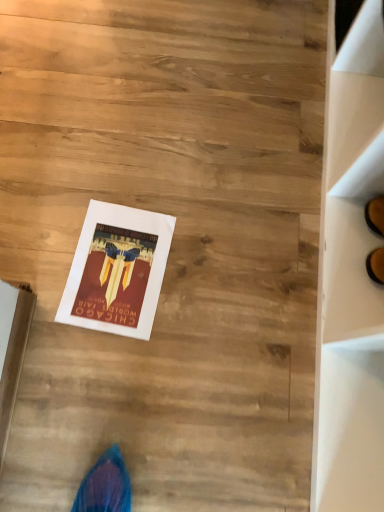
Find the location of `matte paper poster at center`. matte paper poster at center is located at coordinates (x=117, y=270).

Describe the element at coordinates (117, 270) in the screenshot. I see `matte paper poster at center` at that location.

Describe the element at coordinates (12, 349) in the screenshot. I see `white cardboard box at lower left` at that location.

The height and width of the screenshot is (512, 384). I want to click on white cardboard box at lower left, so click(12, 349).

You are a GUI agent. You are given a task and a screenshot of the screen. Output one action in this format:
    pyautogui.click(x=<x>, y=<y>)
    Task: Click on the matte paper poster at center
    
    Given the screenshot: What is the action you would take?
    pyautogui.click(x=117, y=270)

Between white cardboard box at lower left and matte paper poster at center, which one appears on the left side from the viewer's perspective?

white cardboard box at lower left is more to the left.

Does white cardboard box at lower left lie in front of matte paper poster at center?

Yes, the depth of white cardboard box at lower left is less than that of matte paper poster at center.

Is point (5, 361) farther from camera compared to point (106, 317)?

No.

From the picture: From the image's perspective, does white cardboard box at lower left appear lower than matte paper poster at center?

Correct, white cardboard box at lower left appears lower than matte paper poster at center in the image.

From a real-world perspective, is white cardboard box at lower left positioned above or below matte paper poster at center?

white cardboard box at lower left is above matte paper poster at center.

Considering the sizes of objects white cardboard box at lower left and matte paper poster at center in the image provided, who is thinner, white cardboard box at lower left or matte paper poster at center?

With smaller width is white cardboard box at lower left.

From their relative heights in the image, would you say white cardboard box at lower left is taller or shorter than matte paper poster at center?

white cardboard box at lower left is taller than matte paper poster at center.

Considering the relative sizes of white cardboard box at lower left and matte paper poster at center in the image provided, is white cardboard box at lower left smaller than matte paper poster at center?

Yes, white cardboard box at lower left is smaller than matte paper poster at center.

Is white cardboard box at lower left located outside matte paper poster at center?

Yes, white cardboard box at lower left is outside of matte paper poster at center.

Is white cardboard box at lower left in contact with matte paper poster at center?

They are not placed beside each other.

Is white cardboard box at lower left facing away from matte paper poster at center?

No, white cardboard box at lower left is not facing away from matte paper poster at center.

Measure the distance from white cardboard box at lower left to matte paper poster at center.

white cardboard box at lower left is 7.30 inches from matte paper poster at center.

Identify the location of cardboard box above the matte paper poster at center (from a real-world perspective). (12, 349).

Which object is positioned more to the left, matte paper poster at center or white cardboard box at lower left?

From the viewer's perspective, white cardboard box at lower left appears more on the left side.

Considering their positions, is matte paper poster at center located in front of or behind white cardboard box at lower left?

matte paper poster at center is positioned farther from the viewer than white cardboard box at lower left.

Between point (121, 212) and point (23, 330), which one is positioned behind?

The point (121, 212) is farther from the camera.

From the image's perspective, is matte paper poster at center located beneath white cardboard box at lower left?

No, from the image's perspective, matte paper poster at center is not beneath white cardboard box at lower left.

From a real-world perspective, is matte paper poster at center physically above white cardboard box at lower left?

No, from a real-world perspective, matte paper poster at center is not above white cardboard box at lower left.

Which object is thinner, matte paper poster at center or white cardboard box at lower left?

white cardboard box at lower left.

Between matte paper poster at center and white cardboard box at lower left, which one has less height?

matte paper poster at center is shorter.

Looking at the image, does matte paper poster at center seem bigger or smaller compared to white cardboard box at lower left?

In the image, matte paper poster at center appears to be larger than white cardboard box at lower left.

Is white cardboard box at lower left a part of matte paper poster at center?

No, white cardboard box at lower left is not surrounded by matte paper poster at center.

Can you see matte paper poster at center touching white cardboard box at lower left?

No, matte paper poster at center is not beside white cardboard box at lower left.

Is matte paper poster at center oriented towards white cardboard box at lower left?

No, matte paper poster at center does not turn towards white cardboard box at lower left.

From the picture: How many degrees apart are the facing directions of matte paper poster at center and white cardboard box at lower left?

matte paper poster at center and white cardboard box at lower left are facing 96.1 degrees away from each other.

Find the location of a particular element. This screenshot has height=512, width=384. cardboard box on the left of the matte paper poster at center is located at coordinates pos(12,349).

Image resolution: width=384 pixels, height=512 pixels. What are the coordinates of `magazine behind the white cardboard box at lower left` in the screenshot? It's located at [x=117, y=270].

You are a GUI agent. You are given a task and a screenshot of the screen. Output one action in this format:
    pyautogui.click(x=<x>, y=<y>)
    Task: Click on the cardboard box located above the matte paper poster at center (from a real-world perspective)
    This screenshot has height=512, width=384.
    Given the screenshot: What is the action you would take?
    pyautogui.click(x=12, y=349)